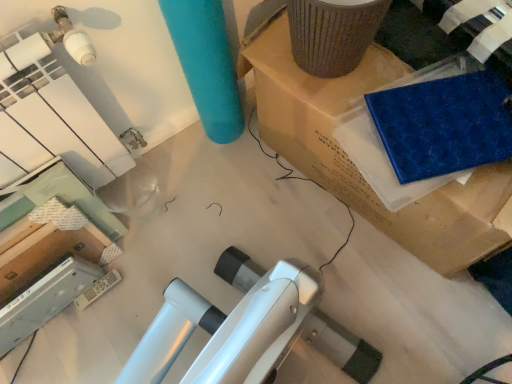
Question: Considering the relative positions of blue rubber mat at upper right and blue sponge at upper right in the image provided, is blue rubber mat at upper right in front of blue sponge at upper right?

Choices:
 (A) yes
 (B) no

Answer: (A)

Question: Considering the relative sizes of blue rubber mat at upper right and blue sponge at upper right in the image provided, is blue rubber mat at upper right smaller than blue sponge at upper right?

Choices:
 (A) yes
 (B) no

Answer: (B)

Question: Is the position of blue rubber mat at upper right more distant than that of blue sponge at upper right?

Choices:
 (A) no
 (B) yes

Answer: (A)

Question: Would you consider blue rubber mat at upper right to be distant from blue sponge at upper right?

Choices:
 (A) no
 (B) yes

Answer: (A)

Question: From a real-world perspective, does blue rubber mat at upper right sit lower than blue sponge at upper right?

Choices:
 (A) yes
 (B) no

Answer: (A)

Question: Is blue rubber mat at upper right to the right of blue sponge at upper right from the viewer's perspective?

Choices:
 (A) yes
 (B) no

Answer: (A)

Question: Is blue sponge at upper right to the left of blue rubber mat at upper right from the viewer's perspective?

Choices:
 (A) no
 (B) yes

Answer: (B)

Question: Is blue sponge at upper right at the right side of blue rubber mat at upper right?

Choices:
 (A) no
 (B) yes

Answer: (A)

Question: Is blue sponge at upper right oriented towards blue rubber mat at upper right?

Choices:
 (A) yes
 (B) no

Answer: (A)

Question: From a real-world perspective, is blue sponge at upper right positioned over blue rubber mat at upper right based on gravity?

Choices:
 (A) no
 (B) yes

Answer: (B)

Question: From the image's perspective, is blue sponge at upper right on top of blue rubber mat at upper right?

Choices:
 (A) no
 (B) yes

Answer: (A)

Question: From a real-world perspective, is blue sponge at upper right under blue rubber mat at upper right?

Choices:
 (A) yes
 (B) no

Answer: (B)

Question: Considering the positions of point (324, 127) and point (488, 162), is point (324, 127) closer or farther from the camera than point (488, 162)?

Choices:
 (A) farther
 (B) closer

Answer: (A)